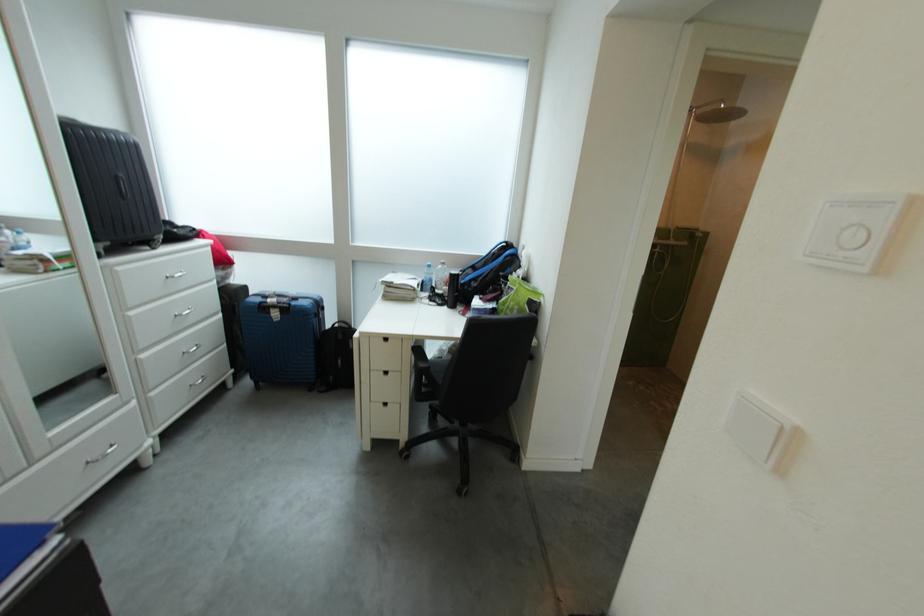
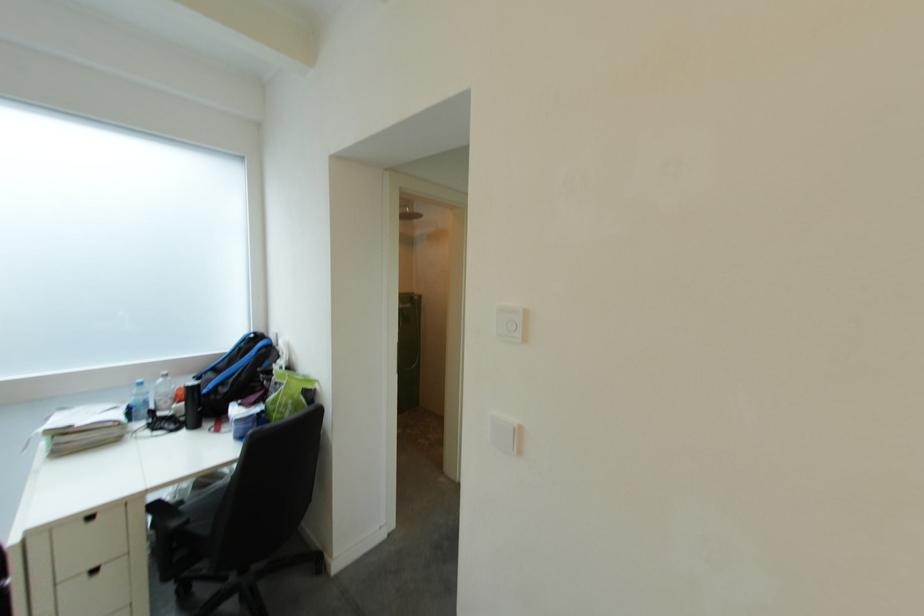
In the second image, find the point that corresponds to (399,288) in the first image.

(73, 436)